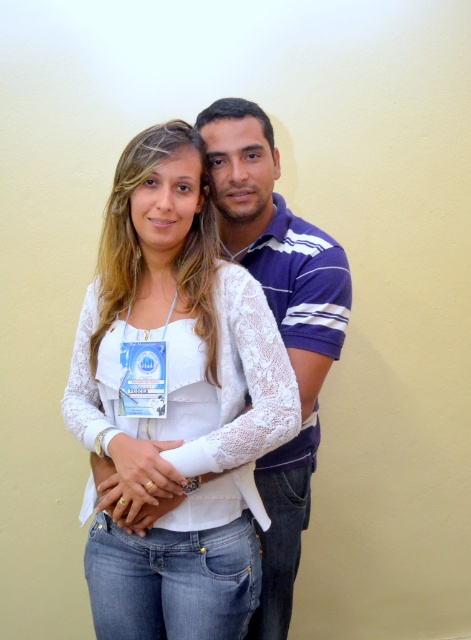
Which of these two, white lace top at center or blue striped polo shirt at center, stands taller?

blue striped polo shirt at center

Can you confirm if white lace top at center is positioned to the left of blue striped polo shirt at center?

Indeed, white lace top at center is positioned on the left side of blue striped polo shirt at center.

Who is more forward, (144, 212) or (252, 636)?

Point (144, 212) is in front.

In order to click on white lace top at center in this screenshot , I will do `click(171, 310)`.